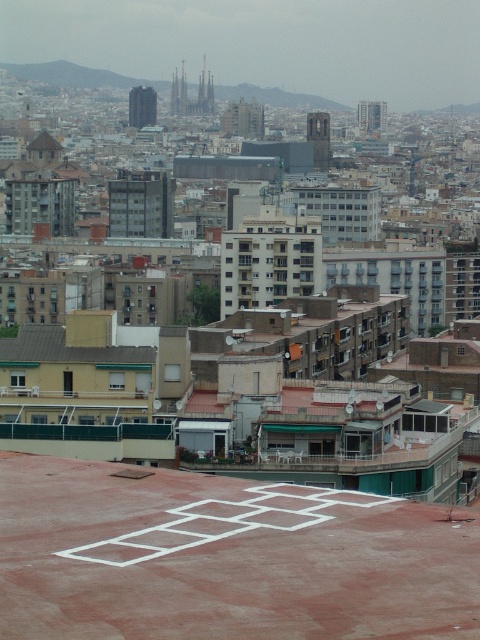
Who is higher up, red concrete hopscotch at center or brown corrugated metal roof at center?

brown corrugated metal roof at center is above.

Does red concrete hopscotch at center have a greater width compared to brown corrugated metal roof at center?

In fact, red concrete hopscotch at center might be narrower than brown corrugated metal roof at center.

Between point (343, 520) and point (80, 348), which one is positioned in front?

Point (343, 520)

You are a GUI agent. You are given a task and a screenshot of the screen. Output one action in this format:
    pyautogui.click(x=<x>, y=<y>)
    Task: Click on the red concrete hopscotch at center
    The height and width of the screenshot is (640, 480).
    Given the screenshot: What is the action you would take?
    pyautogui.click(x=225, y=557)